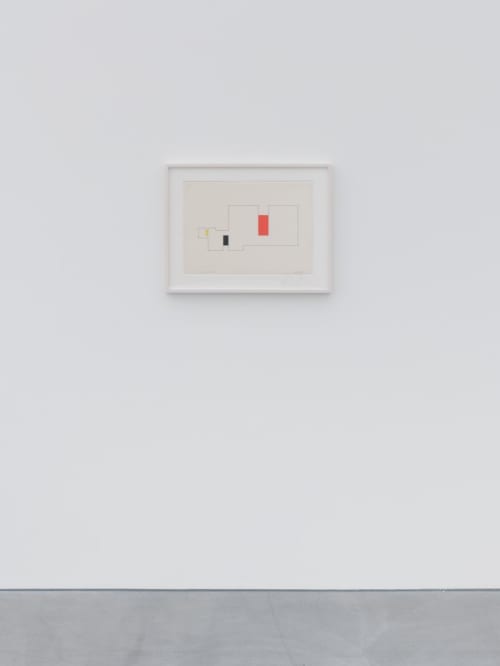
Where is `shadow under frame`? This screenshot has height=666, width=500. shadow under frame is located at coordinates (234, 294).